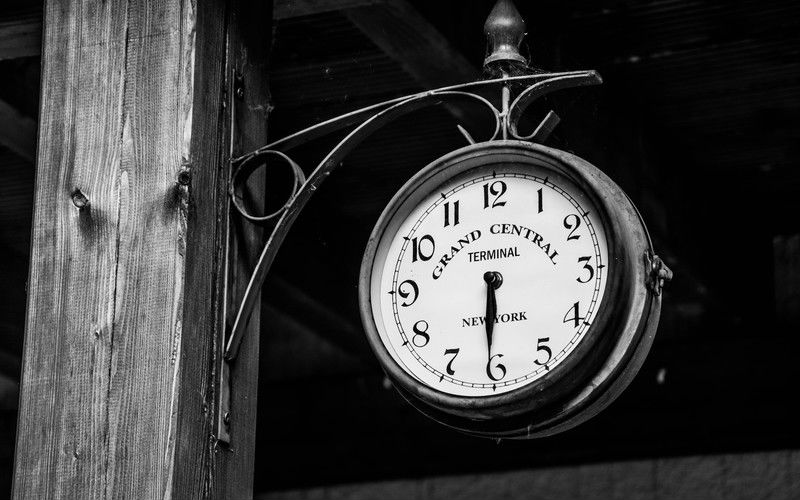
This screenshot has width=800, height=500. In order to click on white clock face in this screenshot , I will do `click(461, 282)`.